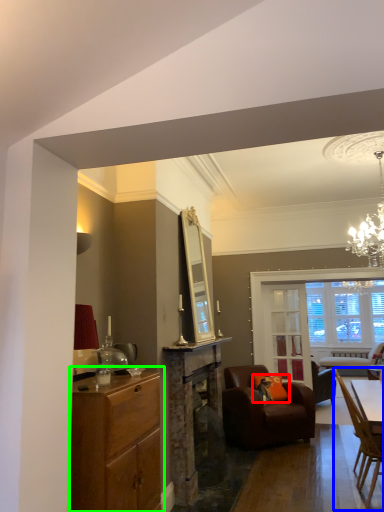
Question: Which object is positioned closest to pillow (highlighted by a red box)? Select from chair (highlighted by a blue box) and cabinetry (highlighted by a green box).

Choices:
 (A) chair
 (B) cabinetry

Answer: (A)